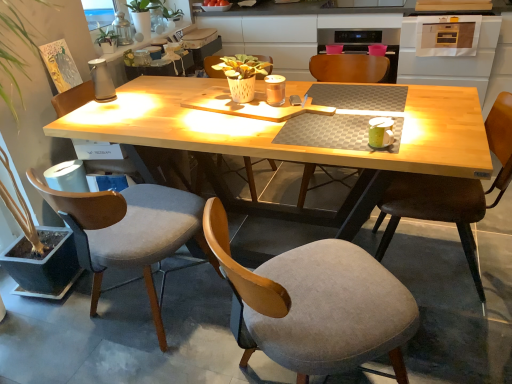
Question: From a real-world perspective, is gray fabric chair at lower center, the third chair when ordered from right to left, positioned under gray fabric chair at left, the 6th chair from the right, based on gravity?

Choices:
 (A) yes
 (B) no

Answer: (A)

Question: Considering the relative positions of gray fabric chair at lower center, the third chair when ordered from right to left, and gray fabric chair at left, the 6th chair from the right, in the image provided, is gray fabric chair at lower center, the third chair when ordered from right to left, to the left of gray fabric chair at left, the 6th chair from the right, from the viewer's perspective?

Choices:
 (A) no
 (B) yes

Answer: (A)

Question: Is gray fabric chair at lower center, the 4th chair in the left-to-right sequence, smaller than gray fabric chair at left, which is the 1th chair in left-to-right order?

Choices:
 (A) yes
 (B) no

Answer: (A)

Question: Is gray fabric chair at left, which is the 1th chair in left-to-right order, located within gray fabric chair at lower center, the third chair when ordered from right to left?

Choices:
 (A) yes
 (B) no

Answer: (B)

Question: Considering the relative sizes of gray fabric chair at lower center, the third chair when ordered from right to left, and gray fabric chair at left, which is the 1th chair in left-to-right order, in the image provided, is gray fabric chair at lower center, the third chair when ordered from right to left, taller than gray fabric chair at left, which is the 1th chair in left-to-right order,?

Choices:
 (A) no
 (B) yes

Answer: (A)

Question: From the image's perspective, is velvet grey chair at left, which appears as the 5th chair when viewed from the right, positioned above or below green matte coffee cup at upper right?

Choices:
 (A) above
 (B) below

Answer: (B)

Question: From a real-world perspective, is velvet grey chair at left, which is the 2th chair in left-to-right order, positioned above or below green matte coffee cup at upper right?

Choices:
 (A) above
 (B) below

Answer: (B)

Question: In terms of size, does velvet grey chair at left, which appears as the 5th chair when viewed from the right, appear bigger or smaller than green matte coffee cup at upper right?

Choices:
 (A) small
 (B) big

Answer: (B)

Question: Considering the positions of velvet grey chair at left, which appears as the 5th chair when viewed from the right, and green matte coffee cup at upper right in the image, is velvet grey chair at left, which appears as the 5th chair when viewed from the right, wider or thinner than green matte coffee cup at upper right?

Choices:
 (A) thin
 (B) wide

Answer: (B)

Question: Is wooden chair at center, marked as the 4th chair in a right-to-left arrangement, in front of or behind brown leather chair at right, the 6th chair positioned from the left, in the image?

Choices:
 (A) behind
 (B) front

Answer: (A)

Question: Looking at the image, does wooden chair at center, marked as the 4th chair in a right-to-left arrangement, seem bigger or smaller compared to brown leather chair at right, the 6th chair positioned from the left?

Choices:
 (A) big
 (B) small

Answer: (B)

Question: Is wooden chair at center, marked as the 4th chair in a right-to-left arrangement, taller or shorter than brown leather chair at right, acting as the first chair starting from the right?

Choices:
 (A) short
 (B) tall

Answer: (A)

Question: Is wooden chair at center, marked as the 4th chair in a right-to-left arrangement, wider or thinner than brown leather chair at right, the 6th chair positioned from the left?

Choices:
 (A) wide
 (B) thin

Answer: (A)

Question: Visually, is wooden chair at center, marked as the 4th chair in a right-to-left arrangement, positioned to the left or to the right of green matte coffee cup at upper right?

Choices:
 (A) left
 (B) right

Answer: (A)

Question: Looking at the image, does wooden chair at center, marked as the 4th chair in a right-to-left arrangement, seem bigger or smaller compared to green matte coffee cup at upper right?

Choices:
 (A) small
 (B) big

Answer: (B)